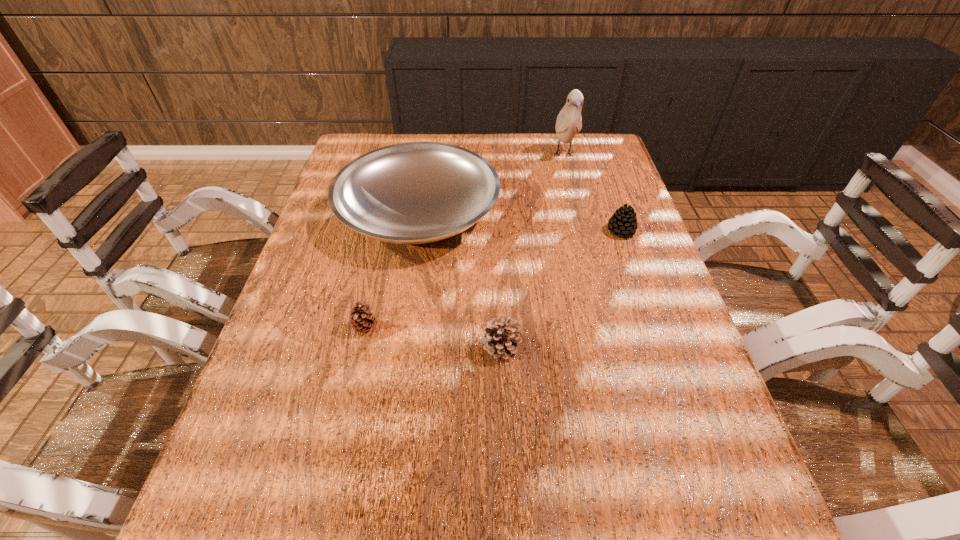
What are the coordinates of `free point located 0.360m at the narrow end of the rightmost object` in the screenshot? It's located at (474, 231).

You are a GUI agent. You are given a task and a screenshot of the screen. Output one action in this format:
    pyautogui.click(x=<x>, y=<y>)
    Task: Click on the free space located 0.050m at the narrow end of the rightmost object
    Image resolution: width=960 pixels, height=540 pixels.
    Given the screenshot: What is the action you would take?
    pyautogui.click(x=588, y=231)

Where is `free space located at the narrow end of the rightmost object`? free space located at the narrow end of the rightmost object is located at coordinates (515, 231).

Locate an element on the screen. The height and width of the screenshot is (540, 960). blank space located 0.170m on the left of the leftmost pinecone is located at coordinates (276, 328).

Locate an element on the screen. Image resolution: width=960 pixels, height=540 pixels. bird located at the far edge is located at coordinates (569, 121).

Locate an element on the screen. bedpan present at the far edge is located at coordinates (416, 192).

This screenshot has height=540, width=960. What are the coordinates of `object that is at the left edge` in the screenshot? It's located at (x=416, y=192).

The height and width of the screenshot is (540, 960). What are the coordinates of `bird that is at the right edge` in the screenshot? It's located at (569, 121).

In order to click on pinecone positioned at the right edge in this screenshot , I will do `click(623, 222)`.

The image size is (960, 540). What are the coordinates of `object at the far left corner` in the screenshot? It's located at (416, 192).